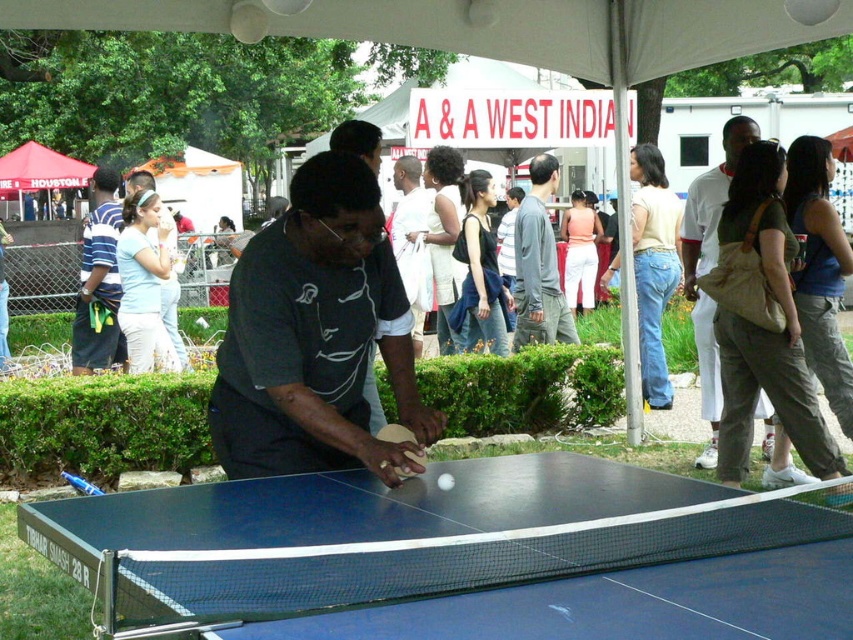
Question: Among these points, which one is nearest to the camera?

Choices:
 (A) (410, 474)
 (B) (566, 332)
 (C) (573, 604)
 (D) (103, 269)

Answer: (C)

Question: Does blue rubber table tennis table at center have a greater width compared to white cotton shirt at right?

Choices:
 (A) yes
 (B) no

Answer: (A)

Question: Is striped cotton shirt at left to the right of wooden table tennis racket at center from the viewer's perspective?

Choices:
 (A) no
 (B) yes

Answer: (A)

Question: From the image, what is the correct spatial relationship of blue rubber table tennis table at center in relation to gray cotton shirt at center?

Choices:
 (A) left
 (B) right

Answer: (A)

Question: Among these objects, which one is farthest from the camera?

Choices:
 (A) wooden table tennis racket at center
 (B) white cotton shirt at right
 (C) striped cotton shirt at left

Answer: (C)

Question: Which of these objects is positioned farthest from the blue rubber table tennis racket at lower left?

Choices:
 (A) blue plastic table tennis table at center
 (B) red fabric canopy at upper left
 (C) striped cotton shirt at left

Answer: (B)